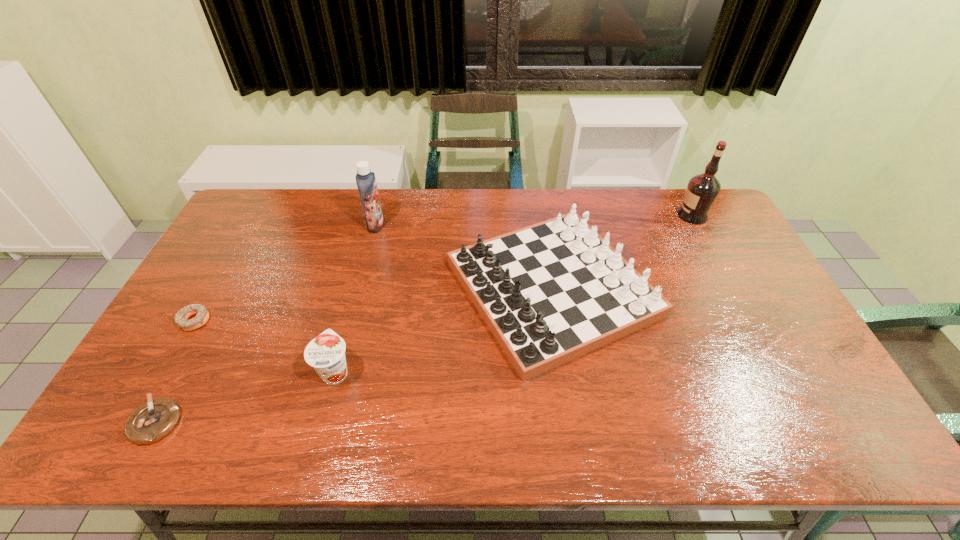
Locate an element on the screen. Image resolution: width=960 pixels, height=540 pixels. free space located on the surface of the tallest object is located at coordinates coord(611,215).

You are a GUI agent. You are given a task and a screenshot of the screen. Output one action in this format:
    pyautogui.click(x=<x>, y=<y>)
    Task: Click on the vacant space situated on the front label of the fifth shortest object
    The width and height of the screenshot is (960, 540).
    Given the screenshot: What is the action you would take?
    click(404, 225)

I want to click on free space located 0.130m on the front of the third tallest object, so click(574, 434).

Find the location of a particular element. The image size is (960, 540). free region located 0.360m on the left of the third shortest object is located at coordinates [177, 371].

Image resolution: width=960 pixels, height=540 pixels. What are the coordinates of `vacant space positioned 0.250m on the front of the doughnut` in the screenshot? It's located at (138, 418).

Where is `free location located on the right of the nearest object`? The height and width of the screenshot is (540, 960). free location located on the right of the nearest object is located at coordinates (270, 421).

Image resolution: width=960 pixels, height=540 pixels. I want to click on liquor situated at the far edge, so click(702, 190).

Locate an element on the screen. shampoo that is positioned at the far edge is located at coordinates (365, 179).

In order to click on gameboard located in the far edge section of the desktop in this screenshot , I will do `click(551, 292)`.

The image size is (960, 540). Identify the location of object positioned at the near edge. (156, 418).